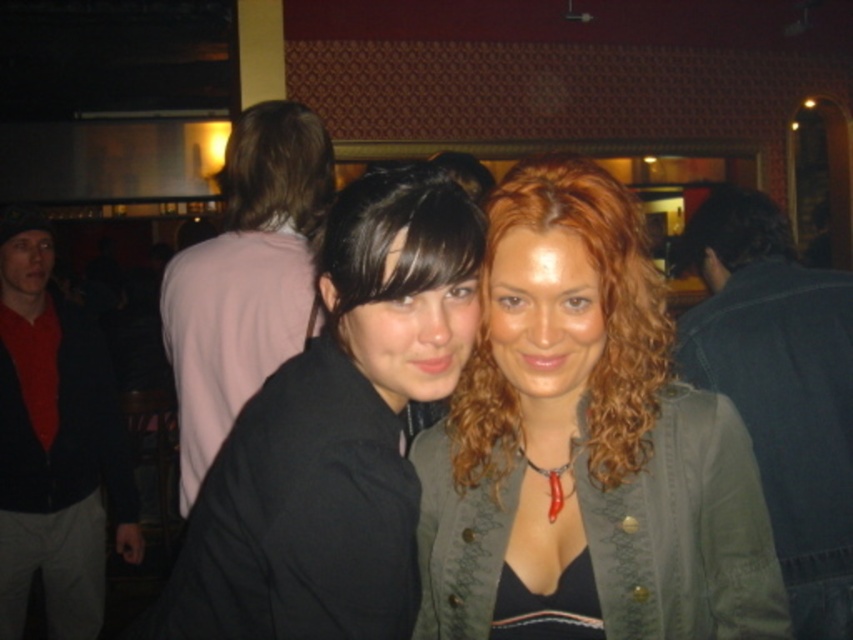
Does black matte shirt at center appear over matte black jacket at center?

No.

Is black matte shirt at center behind matte black jacket at center?

No, black matte shirt at center is closer to the viewer.

You are a GUI agent. You are given a task and a screenshot of the screen. Output one action in this format:
    pyautogui.click(x=<x>, y=<y>)
    Task: Click on the black matte shirt at center
    This screenshot has width=853, height=640.
    Given the screenshot: What is the action you would take?
    pyautogui.click(x=335, y=433)

At what (x,y) coordinates should I click in order to perform the action: click on black matte shirt at center. Please return your answer as a coordinate pair (x, y). This screenshot has height=640, width=853. Looking at the image, I should click on pos(335,433).

Does point (422, 616) lie behind point (47, 598)?

No.

Who is more distant from viewer, (663, 576) or (27, 412)?

The point (27, 412) is more distant.

Is point (531, 316) in front of point (44, 358)?

That is True.

You are a GUI agent. You are given a task and a screenshot of the screen. Output one action in this format:
    pyautogui.click(x=<x>, y=<y>)
    Task: Click on the matte green jacket at center
    This screenshot has height=640, width=853.
    Given the screenshot: What is the action you would take?
    pyautogui.click(x=585, y=444)

Is matte green jacket at center positioned in front of pink fabric shirt at upper left?

Yes, matte green jacket at center is closer to the viewer.

The image size is (853, 640). What are the coordinates of `matte green jacket at center` in the screenshot? It's located at (585, 444).